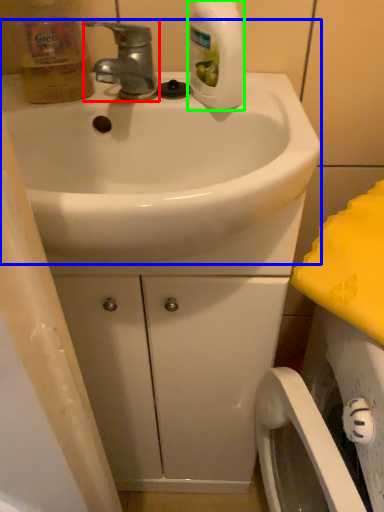
Question: Considering the real-world distances, which object is closest to tap (highlighted by a red box)? sink (highlighted by a blue box) or cleaning product (highlighted by a green box).

Choices:
 (A) sink
 (B) cleaning product

Answer: (B)